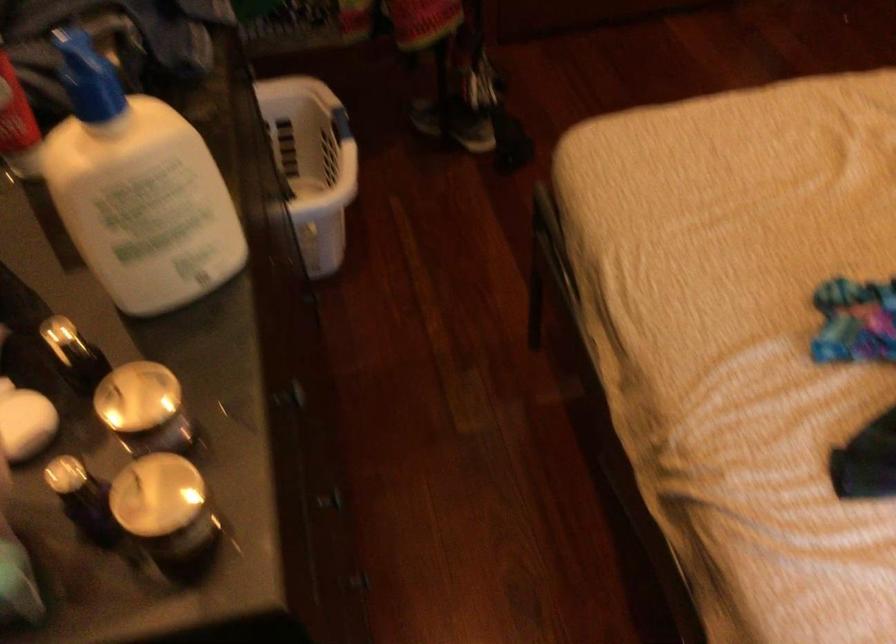
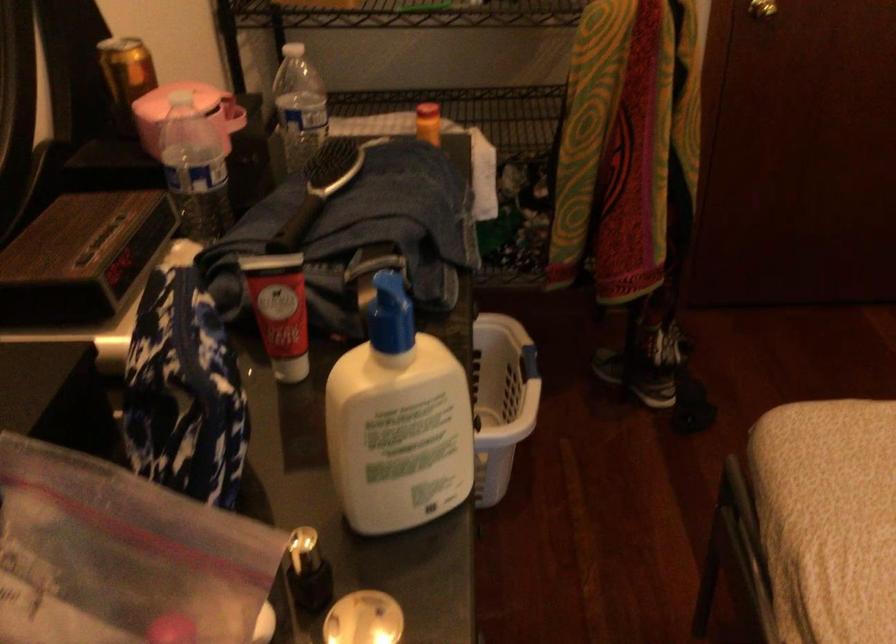
Find the pixel in the second image that matches point (622, 191) in the first image.

(828, 488)